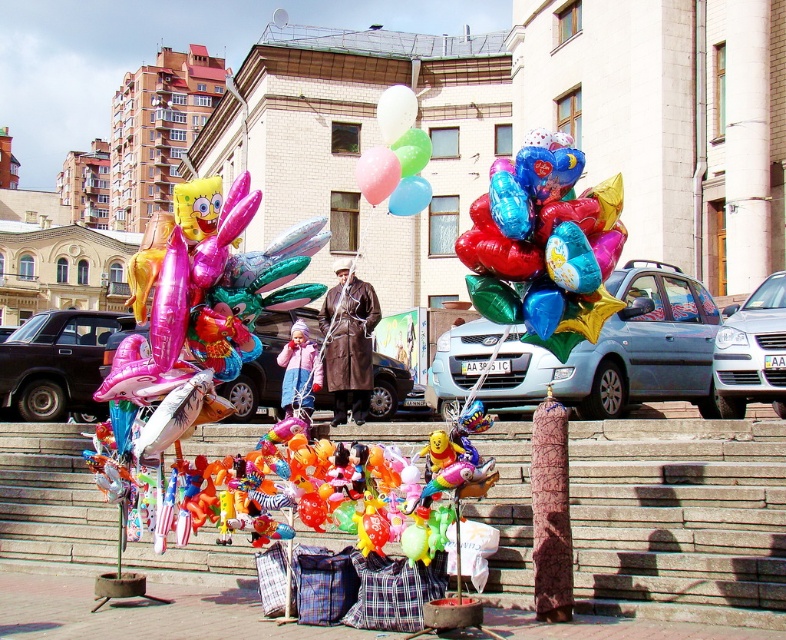
Question: Among these objects, which one is nearest to the camera?

Choices:
 (A) stone steps at center
 (B) brown leather coat at center
 (C) translucent pink balloon at center

Answer: (A)

Question: Is the position of translucent plastic balloon at center less distant than that of translucent blue balloon at center?

Choices:
 (A) yes
 (B) no

Answer: (B)

Question: Which point is farther to the camera?

Choices:
 (A) (90, 614)
 (B) (406, 177)
 (C) (340, 404)

Answer: (C)

Question: Which point is farther to the camera?

Choices:
 (A) (342, 266)
 (B) (417, 182)

Answer: (A)

Question: Can you confirm if shiny metallic balloons at center is positioned above translucent plastic balloon at center?

Choices:
 (A) yes
 (B) no

Answer: (B)

Question: Is brick pavement at lower center positioned before brown leather coat at center?

Choices:
 (A) yes
 (B) no

Answer: (A)